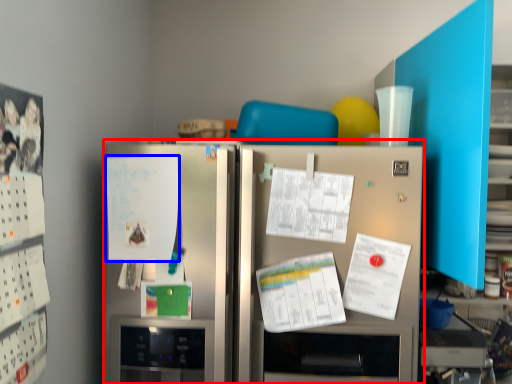
Question: Which of the following is the farthest to the observer, refrigerator (highlighted by a red box) or poster (highlighted by a blue box)?

Choices:
 (A) refrigerator
 (B) poster

Answer: (B)